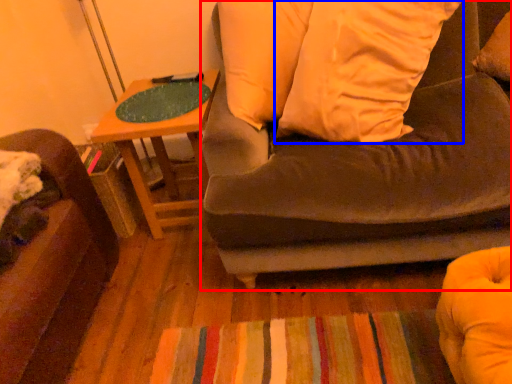
Question: Which object is closer to the camera taking this photo, studio couch (highlighted by a red box) or pillow (highlighted by a blue box)?

Choices:
 (A) studio couch
 (B) pillow

Answer: (A)